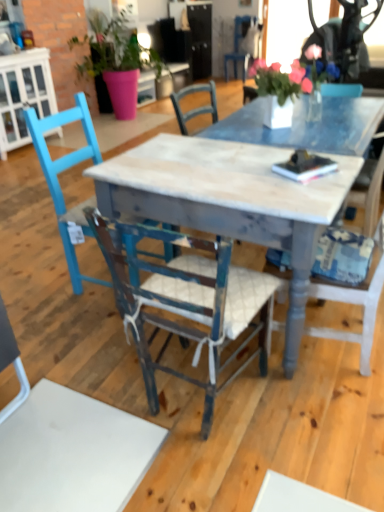
Question: Does matte pink pot at upper left have a greater height compared to white glossy cabinet at left?

Choices:
 (A) no
 (B) yes

Answer: (B)

Question: Is matte pink pot at upper left bigger than white glossy cabinet at left?

Choices:
 (A) yes
 (B) no

Answer: (A)

Question: From the image's perspective, is matte pink pot at upper left located beneath white glossy cabinet at left?

Choices:
 (A) yes
 (B) no

Answer: (B)

Question: From the image's perspective, does matte pink pot at upper left appear higher than white glossy cabinet at left?

Choices:
 (A) yes
 (B) no

Answer: (A)

Question: From a real-world perspective, is matte pink pot at upper left over white glossy cabinet at left?

Choices:
 (A) no
 (B) yes

Answer: (B)

Question: Would you say matte pink pot at upper left contains white glossy cabinet at left?

Choices:
 (A) no
 (B) yes

Answer: (A)

Question: Does distressed wood desk at center have a greater height compared to wooden chair at center, which is counted as the first chair, starting from the top?

Choices:
 (A) no
 (B) yes

Answer: (A)

Question: Does distressed wood desk at center have a greater width compared to wooden chair at center, the first chair when ordered from back to front?

Choices:
 (A) no
 (B) yes

Answer: (B)

Question: Is wooden chair at center, placed as the fourth chair when sorted from bottom to top, surrounded by distressed wood desk at center?

Choices:
 (A) yes
 (B) no

Answer: (B)

Question: Does distressed wood desk at center have a larger size compared to wooden chair at center, the 4th chair viewed from the front?

Choices:
 (A) no
 (B) yes

Answer: (B)

Question: From the image's perspective, does distressed wood desk at center appear lower than wooden chair at center, the 4th chair viewed from the front?

Choices:
 (A) yes
 (B) no

Answer: (A)

Question: From a real-world perspective, is distressed wood desk at center over wooden chair at center, placed as the fourth chair when sorted from bottom to top?

Choices:
 (A) yes
 (B) no

Answer: (B)